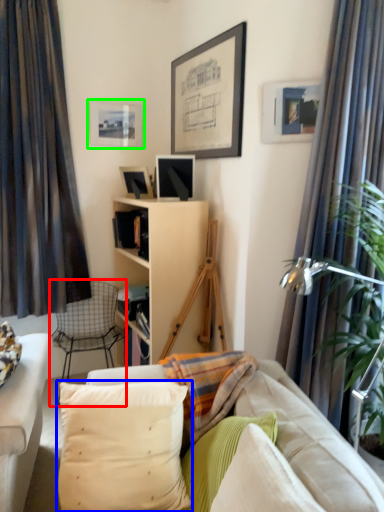
Question: Which is nearer to the chair (highlighted by a red box)? pillow (highlighted by a blue box) or picture frame (highlighted by a green box).

Choices:
 (A) pillow
 (B) picture frame

Answer: (B)